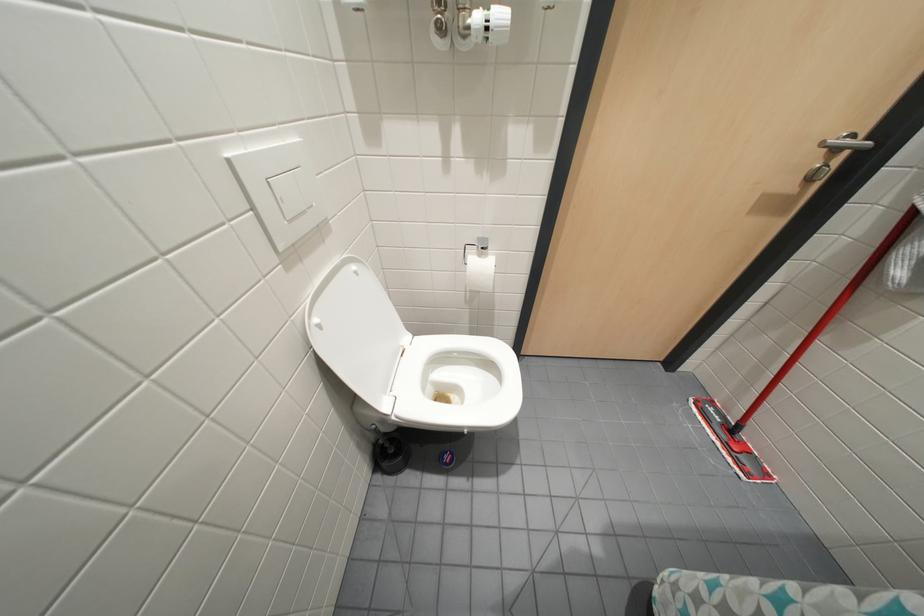
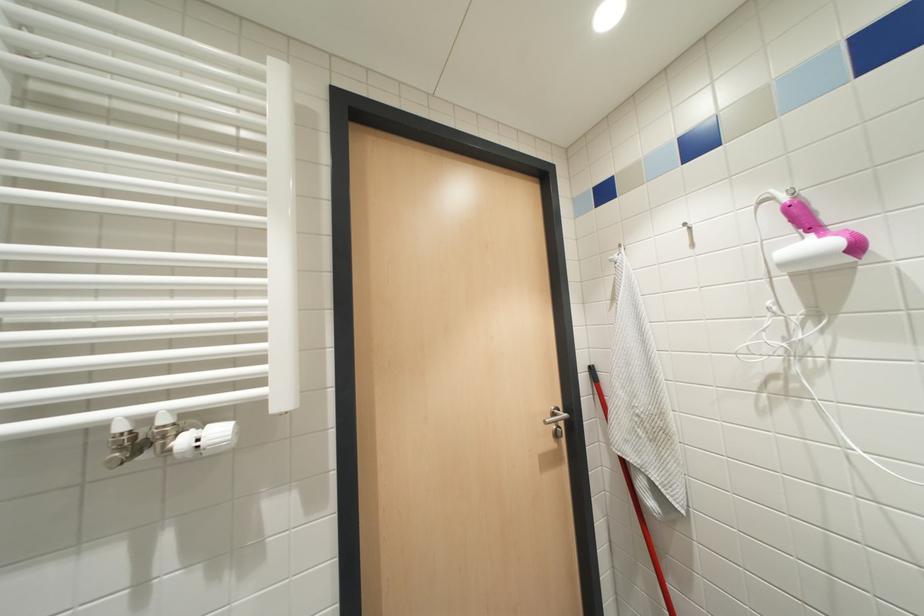
How did the camera likely rotate?

The rotation direction of the camera is right-up.